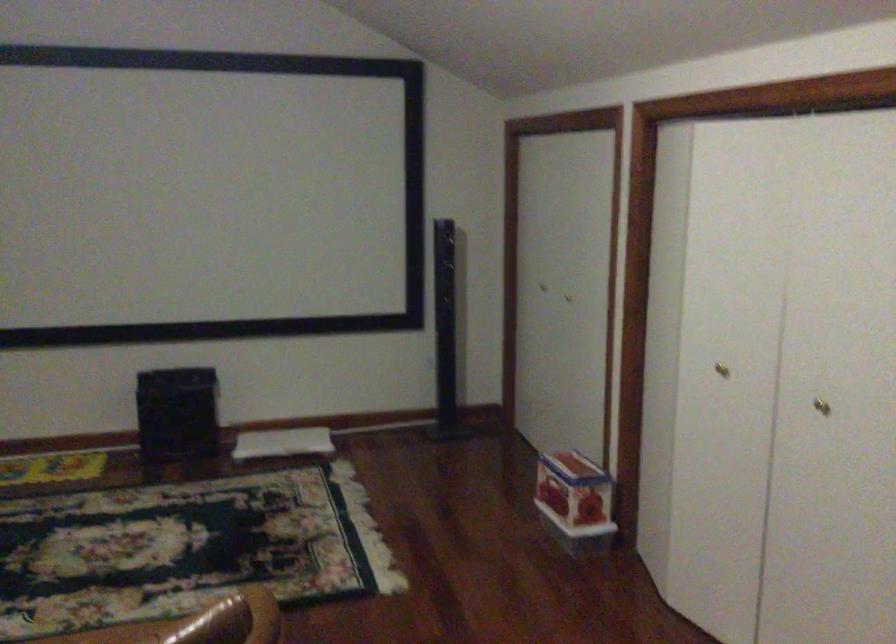
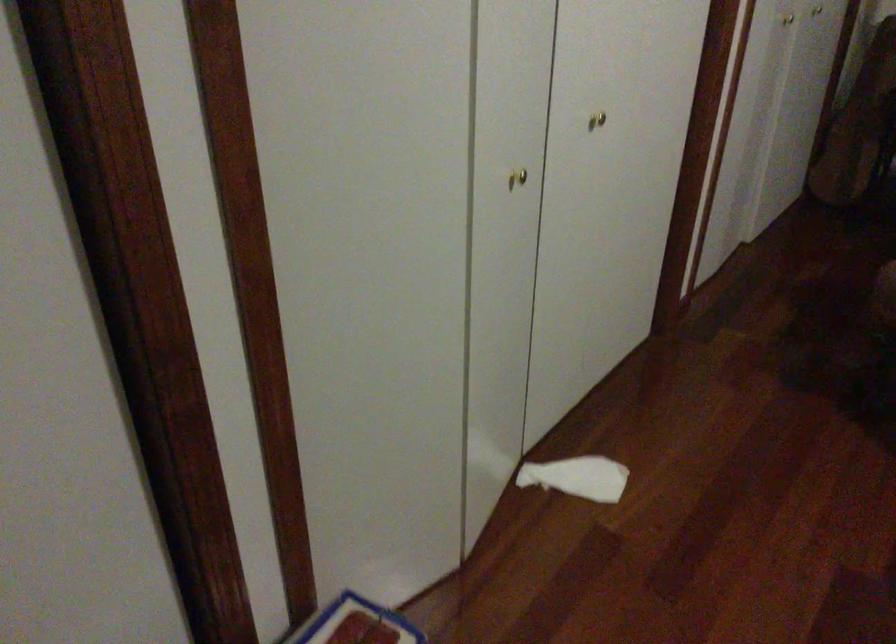
Locate, in the second image, the point that corresponds to point 731,380 in the first image.

(517, 178)